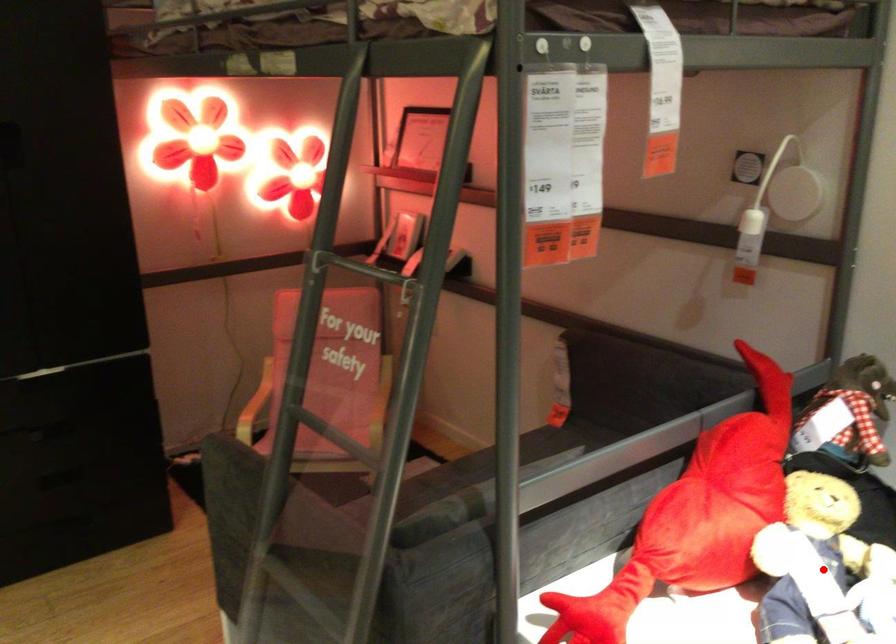
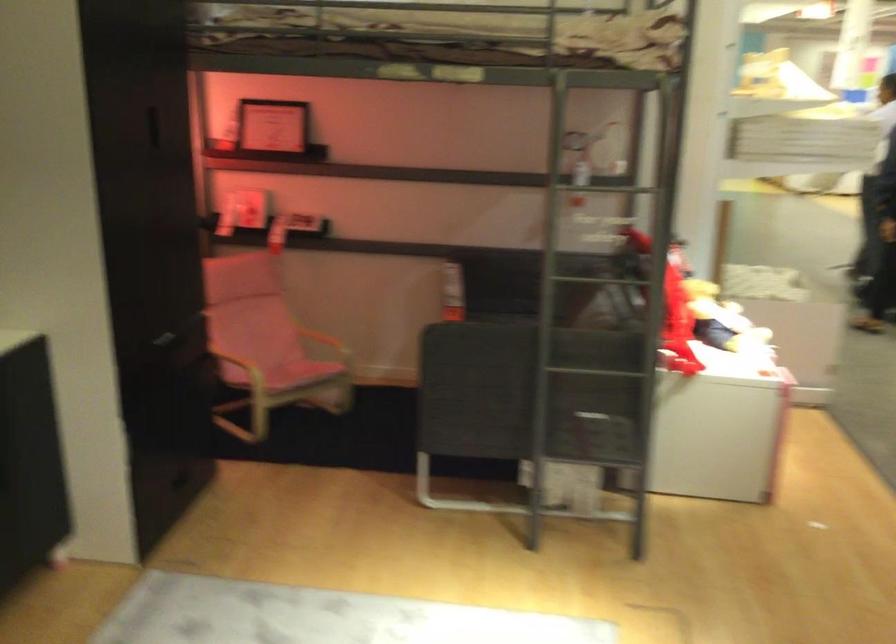
Question: I am providing you with two images of the same scene from different viewpoints. A red point is marked on the first image. Is the red point's position out of view in image 2?

Choices:
 (A) Yes
 (B) No

Answer: (A)